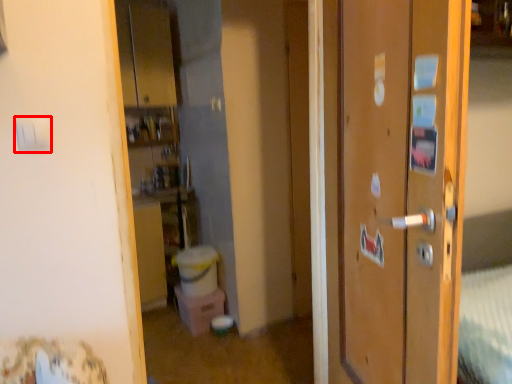
Question: From the image's perspective, what is the correct spatial relationship of light switch (annotated by the red box) in relation to door?

Choices:
 (A) above
 (B) below

Answer: (A)